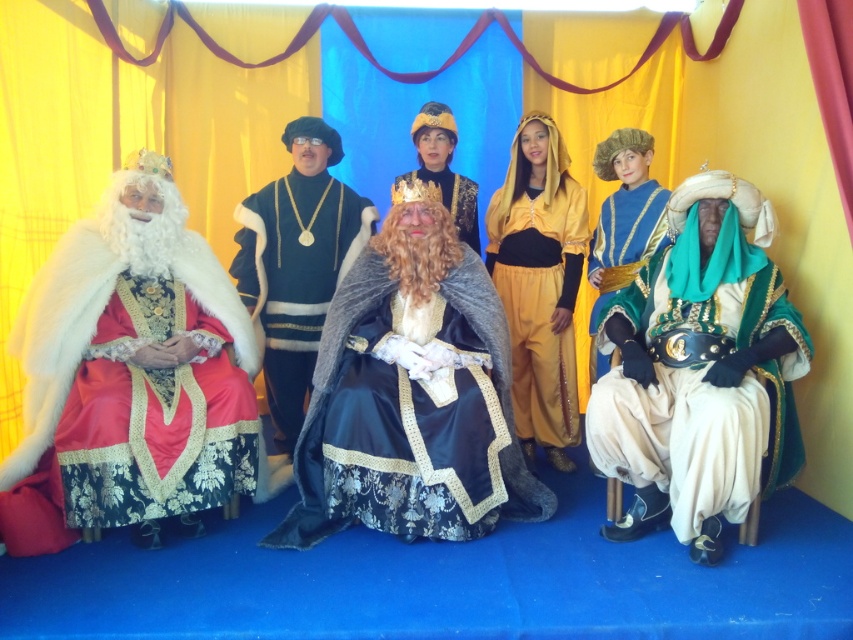
Is golden fabric dress at center taller than blue velvet robe at center?

Yes, golden fabric dress at center is taller than blue velvet robe at center.

Can you confirm if golden fabric dress at center is thinner than blue velvet robe at center?

No, golden fabric dress at center is not thinner than blue velvet robe at center.

The height and width of the screenshot is (640, 853). I want to click on golden fabric dress at center, so click(538, 282).

Consider the image. Between velvet green turban at right and velvet black dress at center, which one is positioned higher?

velvet black dress at center is higher up.

Does velvet green turban at right appear under velvet black dress at center?

Yes.

Image resolution: width=853 pixels, height=640 pixels. I want to click on velvet green turban at right, so click(x=700, y=371).

Between velvet gold crown at center and velvet green turban at right, which one appears on the right side from the viewer's perspective?

Positioned to the right is velvet green turban at right.

From the picture: Does velvet gold crown at center appear on the left side of velvet green turban at right?

Yes, velvet gold crown at center is to the left of velvet green turban at right.

Who is more distant from viewer, [416,268] or [729,390]?

The point [416,268] is behind.

In order to click on velvet gold crown at center in this screenshot , I will do `click(410, 396)`.